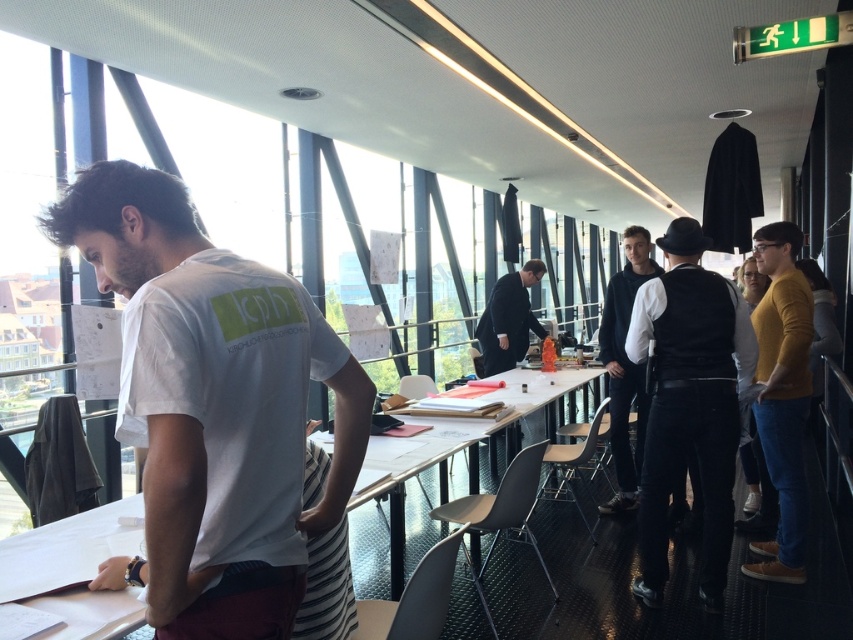
Question: Can you confirm if mustard sweater at right is bigger than matte black suit at center?

Choices:
 (A) yes
 (B) no

Answer: (B)

Question: Can you confirm if mustard sweater at right is positioned to the left of white glossy table at center?

Choices:
 (A) yes
 (B) no

Answer: (B)

Question: Which is farther from the mustard sweater at right?

Choices:
 (A) white glossy table at center
 (B) matte black suit at center
 (C) black leather vest at center
 (D) white cotton t-shirt at left

Answer: (B)

Question: Is mustard sweater at right positioned before black matte jacket at center?

Choices:
 (A) no
 (B) yes

Answer: (B)

Question: Among these objects, which one is farthest from the camera?

Choices:
 (A) black leather vest at center
 (B) white glossy table at center
 (C) white cotton t-shirt at left

Answer: (B)

Question: Which object is closer to the camera taking this photo?

Choices:
 (A) white glossy table at center
 (B) matte black suit at center
 (C) mustard sweater at right
 (D) black matte jacket at center

Answer: (C)